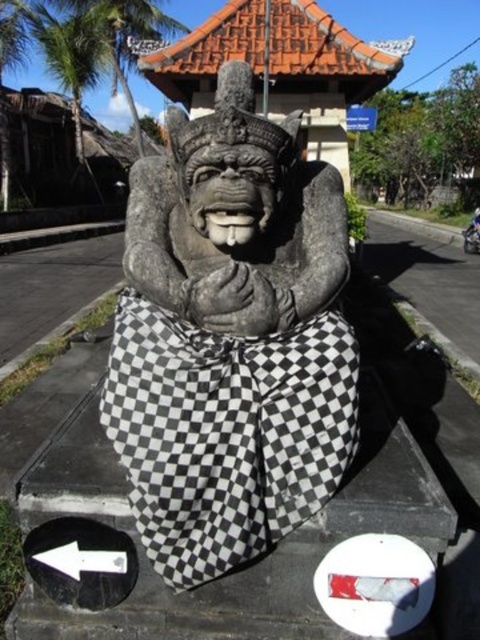
Question: Is stone statue at center positioned behind green leafy palm tree at upper left?

Choices:
 (A) yes
 (B) no

Answer: (B)

Question: Can you confirm if green leafy palm tree at upper left is thinner than metallic silver motorcycle at center?

Choices:
 (A) no
 (B) yes

Answer: (A)

Question: Which of the following is the farthest from the observer?

Choices:
 (A) 134,164
 (B) 474,212

Answer: (B)

Question: Which of these objects is positioned closest to the green leafy palm tree at upper left?

Choices:
 (A) stone statue at center
 (B) metallic silver motorcycle at center

Answer: (B)

Question: Observing the image, what is the correct spatial positioning of stone statue at center in reference to green leafy palm tree at upper left?

Choices:
 (A) below
 (B) above

Answer: (A)

Question: Among these objects, which one is farthest from the camera?

Choices:
 (A) metallic silver motorcycle at center
 (B) green leafy palm tree at upper left

Answer: (B)